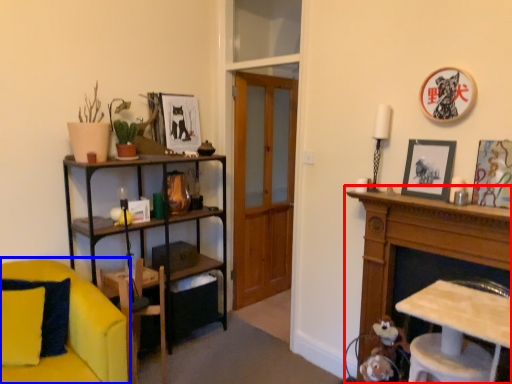
Question: Which of the following is the farthest to the observer, cabinetry (highlighted by a red box) or chair (highlighted by a blue box)?

Choices:
 (A) cabinetry
 (B) chair

Answer: (B)